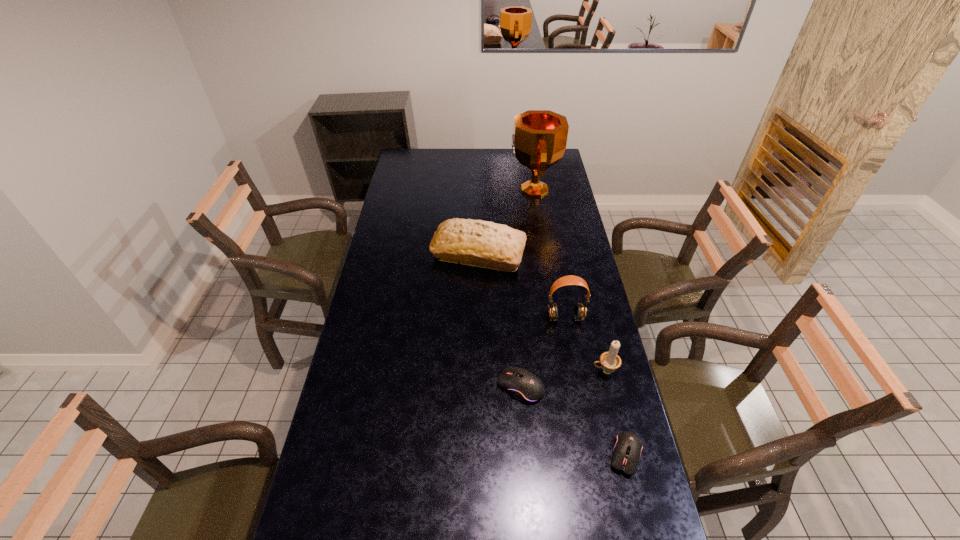
Where is `vacant place for an extra computer mouse on the left`? This screenshot has width=960, height=540. vacant place for an extra computer mouse on the left is located at coordinates (437, 332).